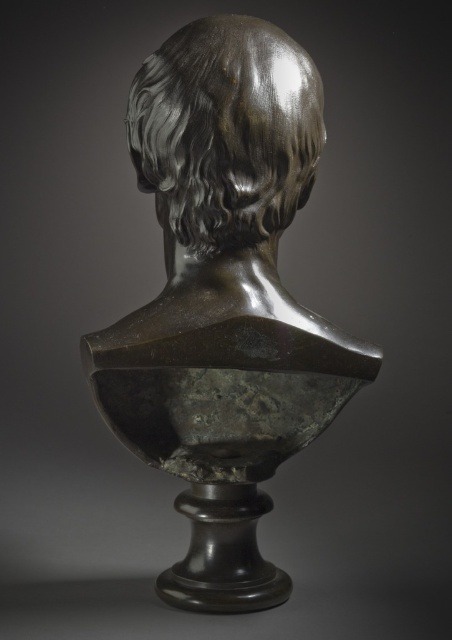
Does bronze bust at center appear under shiny bronze head at center?

Yes.

The width and height of the screenshot is (452, 640). What are the coordinates of `bronze bust at center` in the screenshot? It's located at (224, 298).